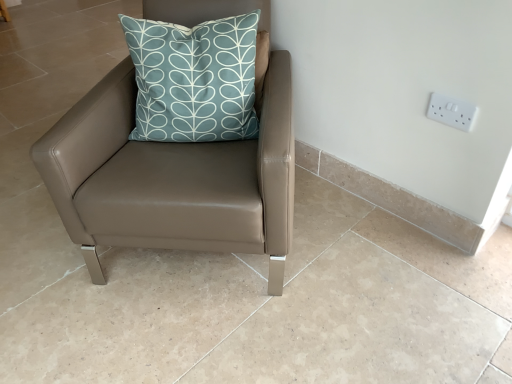
This screenshot has height=384, width=512. What do you see at coordinates (194, 79) in the screenshot? I see `teal fabric cushion at upper center` at bounding box center [194, 79].

Locate an element on the screen. Image resolution: width=512 pixels, height=384 pixels. teal fabric cushion at upper center is located at coordinates (194, 79).

The image size is (512, 384). Describe the element at coordinates (173, 177) in the screenshot. I see `matte brown leather chair at center` at that location.

Locate an element on the screen. teal fabric cushion at upper center is located at coordinates (194, 79).

Could you measure the distance between teal fabric cushion at upper center and white plastic electric outlet at upper right?

The distance of teal fabric cushion at upper center from white plastic electric outlet at upper right is 76.20 centimeters.

Based on the photo, considering the sizes of objects teal fabric cushion at upper center and white plastic electric outlet at upper right in the image provided, who is shorter, teal fabric cushion at upper center or white plastic electric outlet at upper right?

Standing shorter between the two is white plastic electric outlet at upper right.

From the picture: Is teal fabric cushion at upper center oriented away from white plastic electric outlet at upper right?

teal fabric cushion at upper center does not have its back to white plastic electric outlet at upper right.

Does teal fabric cushion at upper center have a smaller size compared to white plastic electric outlet at upper right?

No, teal fabric cushion at upper center is not smaller than white plastic electric outlet at upper right.

What's the angular difference between white plastic electric outlet at upper right and matte brown leather chair at center's facing directions?

The angle between the facing direction of white plastic electric outlet at upper right and the facing direction of matte brown leather chair at center is 37.5 degrees.

Can you confirm if white plastic electric outlet at upper right is shorter than matte brown leather chair at center?

Yes.

Which is in front, white plastic electric outlet at upper right or matte brown leather chair at center?

matte brown leather chair at center is closer to the camera.

Is there a large distance between white plastic electric outlet at upper right and matte brown leather chair at center?

white plastic electric outlet at upper right is actually quite close to matte brown leather chair at center.

Is matte brown leather chair at center turned away from white plastic electric outlet at upper right?

No, matte brown leather chair at center is not facing away from white plastic electric outlet at upper right.

Can you confirm if matte brown leather chair at center is bigger than white plastic electric outlet at upper right?

Yes.

Identify the location of electric outlet that appears on the right of matte brown leather chair at center. pos(452,112).

Can we say matte brown leather chair at center lies outside white plastic electric outlet at upper right?

Indeed, matte brown leather chair at center is completely outside white plastic electric outlet at upper right.

In the scene shown: Would you consider teal fabric cushion at upper center to be distant from matte brown leather chair at center?

No, teal fabric cushion at upper center is in close proximity to matte brown leather chair at center.

Considering the positions of objects teal fabric cushion at upper center and matte brown leather chair at center in the image provided, who is more to the right, teal fabric cushion at upper center or matte brown leather chair at center?

teal fabric cushion at upper center.

Can you confirm if teal fabric cushion at upper center is wider than matte brown leather chair at center?

In fact, teal fabric cushion at upper center might be narrower than matte brown leather chair at center.

Is teal fabric cushion at upper center bigger than matte brown leather chair at center?

Actually, teal fabric cushion at upper center might be smaller than matte brown leather chair at center.

In the image, there is a teal fabric cushion at upper center. At what (x,y) coordinates should I click in order to perform the action: click on chair below it (from the image's perspective). Please return your answer as a coordinate pair (x, y). This screenshot has width=512, height=384. Looking at the image, I should click on (173, 177).

From their relative heights in the image, would you say matte brown leather chair at center is taller or shorter than teal fabric cushion at upper center?

Clearly, matte brown leather chair at center is taller compared to teal fabric cushion at upper center.

In the scene shown: Is matte brown leather chair at center at the right side of teal fabric cushion at upper center?

No, matte brown leather chair at center is not to the right of teal fabric cushion at upper center.

Which object is closer to the camera taking this photo, white plastic electric outlet at upper right or teal fabric cushion at upper center?

teal fabric cushion at upper center is more forward.

This screenshot has width=512, height=384. Identify the location of electric outlet that appears below the teal fabric cushion at upper center (from a real-world perspective). (452, 112).

In the scene shown: Are white plastic electric outlet at upper right and teal fabric cushion at upper center located far from each other?

No.

The width and height of the screenshot is (512, 384). Identify the location of pillow on the left of white plastic electric outlet at upper right. (194, 79).

Where is `chair that appears in front of the white plastic electric outlet at upper right`? chair that appears in front of the white plastic electric outlet at upper right is located at coordinates (173, 177).

Which object lies further to the anchor point matte brown leather chair at center, teal fabric cushion at upper center or white plastic electric outlet at upper right?

Among the two, white plastic electric outlet at upper right is located further to matte brown leather chair at center.

Which object lies nearer to the anchor point teal fabric cushion at upper center, white plastic electric outlet at upper right or matte brown leather chair at center?

The object closer to teal fabric cushion at upper center is matte brown leather chair at center.

Considering their positions, is matte brown leather chair at center positioned closer to teal fabric cushion at upper center than white plastic electric outlet at upper right?

matte brown leather chair at center lies closer to teal fabric cushion at upper center than the other object.

Estimate the real-world distances between objects in this image. Which object is further from matte brown leather chair at center, white plastic electric outlet at upper right or teal fabric cushion at upper center?

white plastic electric outlet at upper right is further to matte brown leather chair at center.

Which object lies nearer to the anchor point white plastic electric outlet at upper right, teal fabric cushion at upper center or matte brown leather chair at center?

teal fabric cushion at upper center.

Which object lies nearer to the anchor point white plastic electric outlet at upper right, matte brown leather chair at center or teal fabric cushion at upper center?

teal fabric cushion at upper center is closer to white plastic electric outlet at upper right.

Locate an element on the screen. The image size is (512, 384). pillow between matte brown leather chair at center and white plastic electric outlet at upper right in the horizontal direction is located at coordinates click(194, 79).